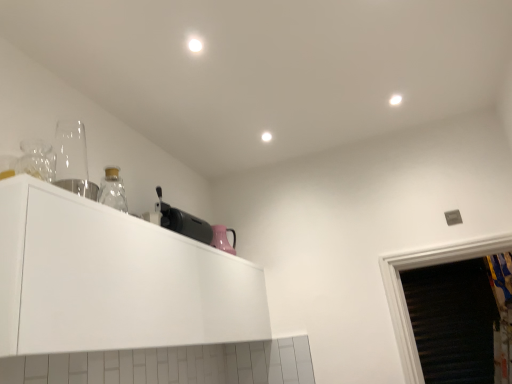
Question: Considering the relative sizes of transparent glass at left, positioned as the first appliance in front-to-back order, and black plastic toaster at upper center, the 2th appliance in the left-to-right sequence, in the image provided, is transparent glass at left, positioned as the first appliance in front-to-back order, thinner than black plastic toaster at upper center, the 2th appliance in the left-to-right sequence,?

Choices:
 (A) yes
 (B) no

Answer: (B)

Question: From a real-world perspective, is transparent glass at left, arranged as the 2th appliance when ordered from the bottom, under black plastic toaster at upper center, positioned as the 1th appliance in back-to-front order?

Choices:
 (A) no
 (B) yes

Answer: (A)

Question: Is transparent glass at left, arranged as the first appliance when viewed from the top, bigger than black plastic toaster at upper center, the first appliance from the right?

Choices:
 (A) yes
 (B) no

Answer: (B)

Question: Would you say transparent glass at left, positioned as the first appliance in front-to-back order, is outside black plastic toaster at upper center, the first appliance from the right?

Choices:
 (A) no
 (B) yes

Answer: (B)

Question: Is black plastic toaster at upper center, which is the 2th appliance in front-to-back order, surrounded by transparent glass at left, arranged as the 2th appliance when ordered from the bottom?

Choices:
 (A) no
 (B) yes

Answer: (A)

Question: Is point (77, 125) closer or farther from the camera than point (187, 215)?

Choices:
 (A) farther
 (B) closer

Answer: (B)

Question: In the image, is transparent glass at left, positioned as the first appliance in front-to-back order, on the left side or the right side of black plastic toaster at upper center, the 2th appliance in the left-to-right sequence?

Choices:
 (A) right
 (B) left

Answer: (B)

Question: Is transparent glass at left, which is the 2th appliance from right to left, spatially inside black plastic toaster at upper center, the first appliance from the right, or outside of it?

Choices:
 (A) inside
 (B) outside

Answer: (B)

Question: From the image's perspective, is transparent glass at left, the first appliance in the left-to-right sequence, positioned above or below black plastic toaster at upper center, which is counted as the 2th appliance, starting from the top?

Choices:
 (A) below
 (B) above

Answer: (B)

Question: Based on their sizes in the image, would you say white glossy cabinet at upper left is bigger or smaller than transparent glass at left, which is the 2th appliance from right to left?

Choices:
 (A) big
 (B) small

Answer: (A)

Question: From the image's perspective, is white glossy cabinet at upper left above or below transparent glass at left, the first appliance in the left-to-right sequence?

Choices:
 (A) above
 (B) below

Answer: (B)

Question: Considering the positions of point (1, 213) and point (76, 192), is point (1, 213) closer or farther from the camera than point (76, 192)?

Choices:
 (A) closer
 (B) farther

Answer: (A)

Question: In terms of width, does white glossy cabinet at upper left look wider or thinner when compared to transparent glass at left, the first appliance in the left-to-right sequence?

Choices:
 (A) wide
 (B) thin

Answer: (A)

Question: Considering the positions of point tap(91, 183) and point tap(218, 281), is point tap(91, 183) closer or farther from the camera than point tap(218, 281)?

Choices:
 (A) closer
 (B) farther

Answer: (A)

Question: From the image's perspective, is transparent glass at left, which is the second appliance from back to front, positioned above or below white glossy cabinet at upper left?

Choices:
 (A) above
 (B) below

Answer: (A)